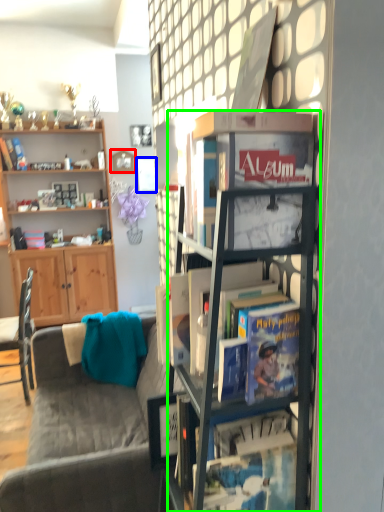
Question: Which is farther away from picture frame (highlighted by a red box)? picture frame (highlighted by a blue box) or easel (highlighted by a green box)?

Choices:
 (A) picture frame
 (B) easel

Answer: (B)